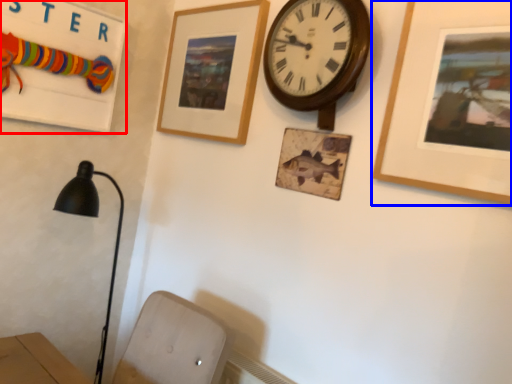
Question: Which object appears closest to the camera in this image, bulletin board (highlighted by a red box) or picture frame (highlighted by a blue box)?

Choices:
 (A) bulletin board
 (B) picture frame

Answer: (B)